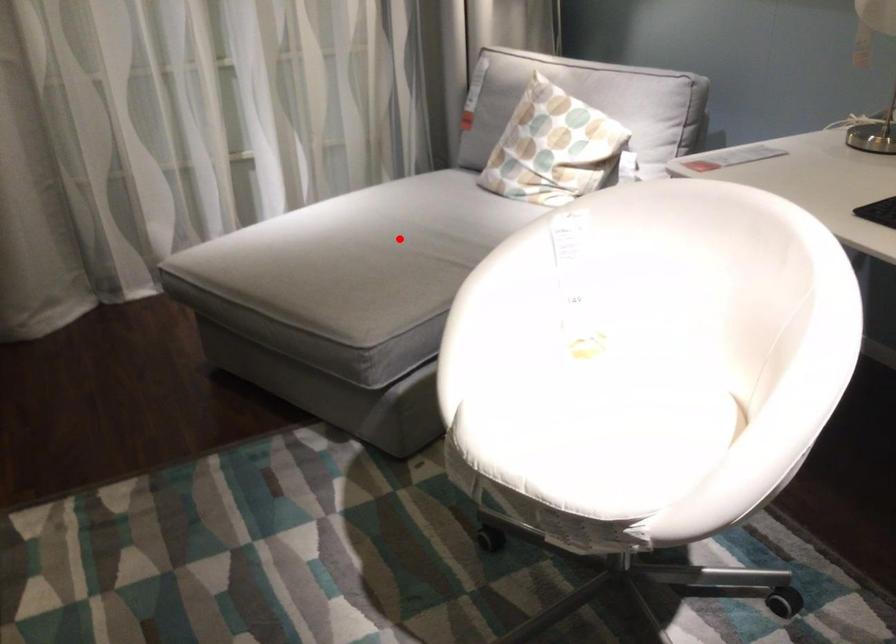
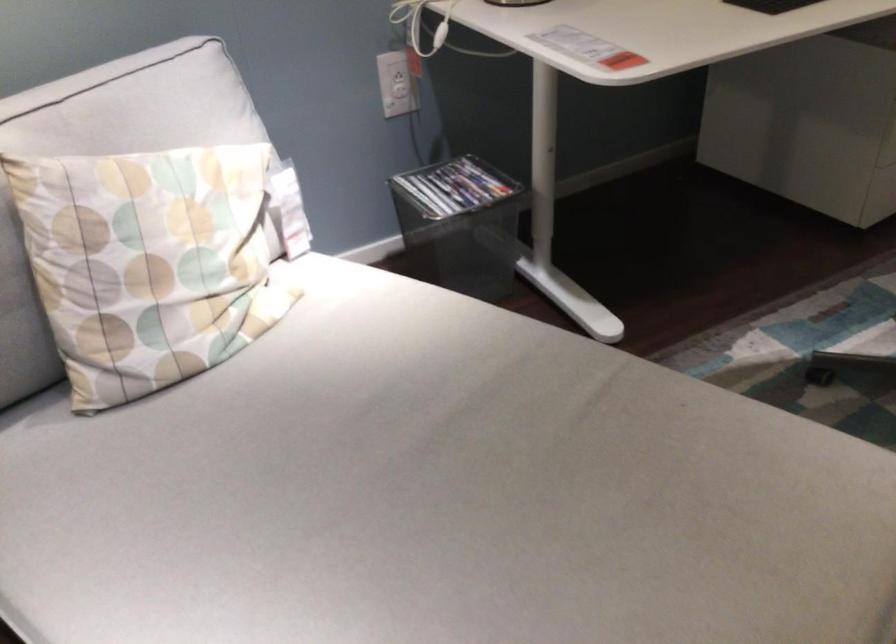
Where in the second image is the point corresponding to the highlighted location from the first image?

(438, 495)